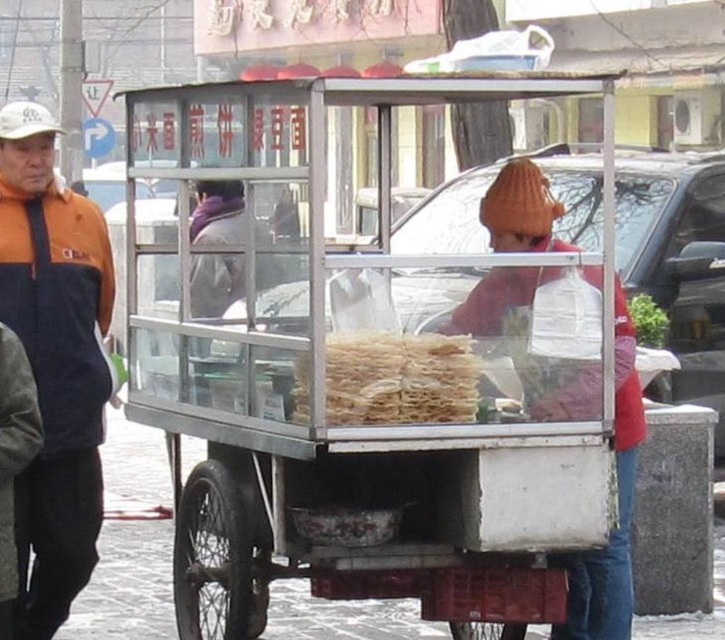
You are a food delivery robot with a 3.5 feet wide delivery box. You need to pass between the orange fleece jacket at left and the translucent plastic noodles at center to reach the customer. Can you fit through the space?

The distance between the orange fleece jacket at left and the translucent plastic noodles at center is 4.37 feet. Since your delivery box is 3.5 feet wide, you can fit through the space as it is wider than your delivery box.

You are a customer standing at the street vendor cart. You want to grab both the orange knit hat at center and the translucent plastic noodles at center. Can you reach both items without moving your position? Explain your reasoning.

The orange knit hat at center is 41.36 centimeters away from the translucent plastic noodles at center. Since the distance between them is over 40 centimeters, you might need to stretch or adjust your reach to grab both items without moving your position, but it might be challenging depending on your arm length.